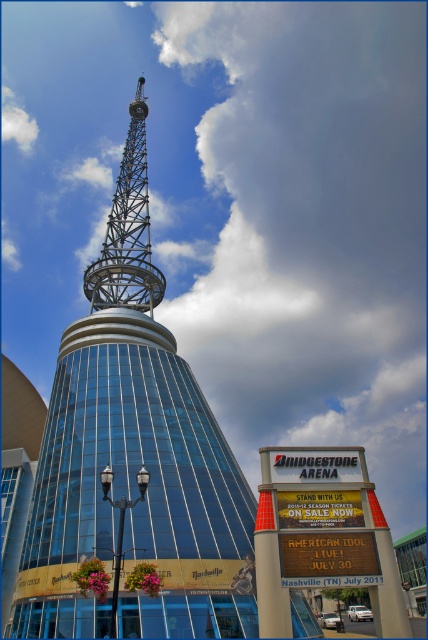
Is metallic structure at upper center in front of metallic lattice tower at upper center?

Yes.

Is point (89, 534) behind point (140, 88)?

No, (89, 534) is in front of (140, 88).

Identify the location of metallic structure at upper center. (122, 461).

In order to click on metallic structure at upper center in this screenshot , I will do `click(122, 461)`.